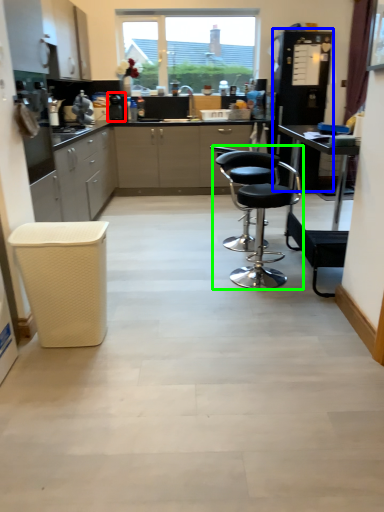
Question: Which is nearer to the appliance (highlighted by a red box)? appliance (highlighted by a blue box) or chair (highlighted by a green box).

Choices:
 (A) appliance
 (B) chair

Answer: (A)